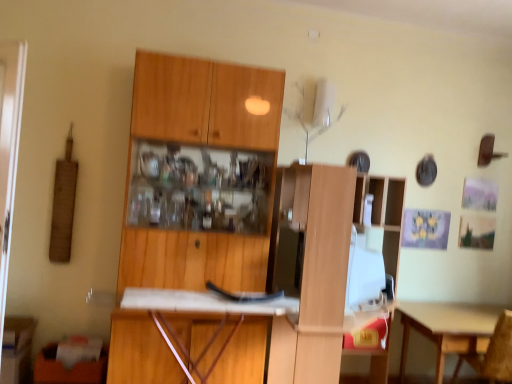
Locate an element on the screen. The image size is (512, 384). wooden chair at lower right is located at coordinates (493, 354).

Describe the element at coordinates (189, 337) in the screenshot. I see `white matte desk at center` at that location.

The width and height of the screenshot is (512, 384). In order to click on wooden chair at lower right in this screenshot , I will do `click(493, 354)`.

From the image's perspective, which one is positioned lower, wooden cabinet at lower left, the 2th cabinetry when ordered from right to left, or wooden cabinet at center, arranged as the second cabinetry when viewed from the left?

From the image's view, wooden cabinet at lower left, the 2th cabinetry when ordered from right to left, is below.

Is wooden cabinet at lower left, the 2th cabinetry when ordered from right to left, at the left side of wooden cabinet at center, arranged as the second cabinetry when viewed from the left?

Yes, wooden cabinet at lower left, the 2th cabinetry when ordered from right to left, is to the left of wooden cabinet at center, arranged as the second cabinetry when viewed from the left.

Where is `cabinetry behind the wooden cabinet at center, the first cabinetry from the right`? cabinetry behind the wooden cabinet at center, the first cabinetry from the right is located at coordinates (17, 349).

From a real-world perspective, is wooden cabinet at lower left, which ranks as the 1th cabinetry in left-to-right order, beneath wooden cabinet at center, the first cabinetry from the right?

Yes.

Does wooden cabinet at lower left, the 2th cabinetry when ordered from right to left, have a larger size compared to white matte desk at center?

No, wooden cabinet at lower left, the 2th cabinetry when ordered from right to left, is not bigger than white matte desk at center.

Does wooden cabinet at lower left, which ranks as the 1th cabinetry in left-to-right order, have a greater width compared to white matte desk at center?

In fact, wooden cabinet at lower left, which ranks as the 1th cabinetry in left-to-right order, might be narrower than white matte desk at center.

Does wooden cabinet at lower left, which ranks as the 1th cabinetry in left-to-right order, have a greater height compared to white matte desk at center?

In fact, wooden cabinet at lower left, which ranks as the 1th cabinetry in left-to-right order, may be shorter than white matte desk at center.

In terms of height, does wooden cabinet at center, the first cabinetry from the right, look taller or shorter compared to wooden chair at lower right?

Considering their sizes, wooden cabinet at center, the first cabinetry from the right, has more height than wooden chair at lower right.

Which of these two, wooden cabinet at center, the first cabinetry from the right, or wooden chair at lower right, is smaller?

Smaller between the two is wooden chair at lower right.

From the image's perspective, is wooden cabinet at center, the first cabinetry from the right, above wooden chair at lower right?

Indeed, from the image's perspective, wooden cabinet at center, the first cabinetry from the right, is shown above wooden chair at lower right.

Considering the sizes of objects wooden cabinet at center, arranged as the second cabinetry when viewed from the left, and wooden chair at lower right in the image provided, who is thinner, wooden cabinet at center, arranged as the second cabinetry when viewed from the left, or wooden chair at lower right?

wooden cabinet at center, arranged as the second cabinetry when viewed from the left.

Could you tell me if white matte desk at center is facing light brown wooden table at lower right?

No.

From a real-world perspective, is white matte desk at center below light brown wooden table at lower right?

No, from a real-world perspective, white matte desk at center is not below light brown wooden table at lower right.

Is white matte desk at center at the right side of light brown wooden table at lower right?

Incorrect, white matte desk at center is not on the right side of light brown wooden table at lower right.

Image resolution: width=512 pixels, height=384 pixels. In the image, there is a light brown wooden table at lower right. Identify the location of desk above it (from the image's perspective). (189, 337).

This screenshot has width=512, height=384. Identify the location of chair below the white matte desk at center (from the image's perspective). (493, 354).

Between white matte desk at center and wooden chair at lower right, which one has smaller width?

white matte desk at center is thinner.

Is white matte desk at center oriented towards wooden chair at lower right?

No, white matte desk at center does not turn towards wooden chair at lower right.

Considering the points (185, 340) and (414, 303), which point is behind, point (185, 340) or point (414, 303)?

The point (414, 303) is behind.

Considering the sizes of objects wooden cabinet at center, arranged as the second cabinetry when viewed from the left, and light brown wooden table at lower right in the image provided, who is taller, wooden cabinet at center, arranged as the second cabinetry when viewed from the left, or light brown wooden table at lower right?

With more height is wooden cabinet at center, arranged as the second cabinetry when viewed from the left.

Based on the photo, would you say light brown wooden table at lower right is part of wooden cabinet at center, arranged as the second cabinetry when viewed from the left,'s contents?

No, light brown wooden table at lower right is not a part of wooden cabinet at center, arranged as the second cabinetry when viewed from the left.

From a real-world perspective, does wooden cabinet at center, the first cabinetry from the right, stand above light brown wooden table at lower right?

Correct, in the physical world, wooden cabinet at center, the first cabinetry from the right, is higher than light brown wooden table at lower right.

Considering the sizes of wooden cabinet at lower left, which ranks as the 1th cabinetry in left-to-right order, and wooden chair at lower right in the image, is wooden cabinet at lower left, which ranks as the 1th cabinetry in left-to-right order, wider or thinner than wooden chair at lower right?

Considering their sizes, wooden cabinet at lower left, which ranks as the 1th cabinetry in left-to-right order, looks slimmer than wooden chair at lower right.

Locate an element on the screen. The height and width of the screenshot is (384, 512). cabinetry that is the 1st object located above the wooden chair at lower right (from the image's perspective) is located at coordinates (17, 349).

How different are the orientations of wooden cabinet at lower left, the 2th cabinetry when ordered from right to left, and wooden chair at lower right in degrees?

The facing directions of wooden cabinet at lower left, the 2th cabinetry when ordered from right to left, and wooden chair at lower right are 171 degrees apart.

Based on the photo, who is bigger, wooden cabinet at lower left, which ranks as the 1th cabinetry in left-to-right order, or wooden chair at lower right?

With larger size is wooden chair at lower right.

Identify the location of cabinetry above the wooden cabinet at lower left, the 2th cabinetry when ordered from right to left (from a real-world perspective). (199, 175).

Locate an element on the screen. This screenshot has width=512, height=384. cabinetry below the white matte desk at center (from the image's perspective) is located at coordinates (17, 349).

Looking at the image, which one is located further to wooden cabinet at lower left, which ranks as the 1th cabinetry in left-to-right order, wooden chair at lower right or wooden cabinet at center, the first cabinetry from the right?

Based on the image, wooden chair at lower right appears to be further to wooden cabinet at lower left, which ranks as the 1th cabinetry in left-to-right order.

Considering their positions, is white matte desk at center positioned further to wooden cabinet at center, arranged as the second cabinetry when viewed from the left, than wooden cabinet at lower left, which ranks as the 1th cabinetry in left-to-right order?

wooden cabinet at lower left, which ranks as the 1th cabinetry in left-to-right order, is further to wooden cabinet at center, arranged as the second cabinetry when viewed from the left.

Based on their spatial positions, is wooden cabinet at lower left, which ranks as the 1th cabinetry in left-to-right order, or wooden cabinet at center, arranged as the second cabinetry when viewed from the left, closer to light brown wooden table at lower right?

wooden cabinet at center, arranged as the second cabinetry when viewed from the left, lies closer to light brown wooden table at lower right than the other object.

Which object lies nearer to the anchor point wooden cabinet at lower left, which ranks as the 1th cabinetry in left-to-right order, white matte desk at center or light brown wooden table at lower right?

white matte desk at center lies closer to wooden cabinet at lower left, which ranks as the 1th cabinetry in left-to-right order, than the other object.

Looking at this image, from the image, which object appears to be nearer to wooden chair at lower right, wooden cabinet at lower left, the 2th cabinetry when ordered from right to left, or wooden cabinet at center, the first cabinetry from the right?

wooden cabinet at center, the first cabinetry from the right.

When comparing their distances from white matte desk at center, does light brown wooden table at lower right or wooden cabinet at center, the first cabinetry from the right, seem closer?

The object closer to white matte desk at center is wooden cabinet at center, the first cabinetry from the right.

Consider the image. Considering their positions, is wooden chair at lower right positioned closer to wooden cabinet at lower left, which ranks as the 1th cabinetry in left-to-right order, than white matte desk at center?

white matte desk at center is closer to wooden cabinet at lower left, which ranks as the 1th cabinetry in left-to-right order.

Looking at the image, which one is located further to light brown wooden table at lower right, wooden cabinet at lower left, the 2th cabinetry when ordered from right to left, or wooden chair at lower right?

wooden cabinet at lower left, the 2th cabinetry when ordered from right to left, lies further to light brown wooden table at lower right than the other object.

Image resolution: width=512 pixels, height=384 pixels. Find the location of `desk situated between wooden cabinet at center, the first cabinetry from the right, and wooden chair at lower right from left to right`. desk situated between wooden cabinet at center, the first cabinetry from the right, and wooden chair at lower right from left to right is located at coordinates (189, 337).

Identify the location of table located between wooden cabinet at center, arranged as the second cabinetry when viewed from the left, and wooden chair at lower right in the left-right direction. (448, 328).

What are the coordinates of `desk between wooden cabinet at center, the first cabinetry from the right, and light brown wooden table at lower right, in the horizontal direction` in the screenshot? It's located at (189, 337).

This screenshot has width=512, height=384. Identify the location of table between wooden cabinet at lower left, which ranks as the 1th cabinetry in left-to-right order, and wooden chair at lower right from left to right. (448, 328).